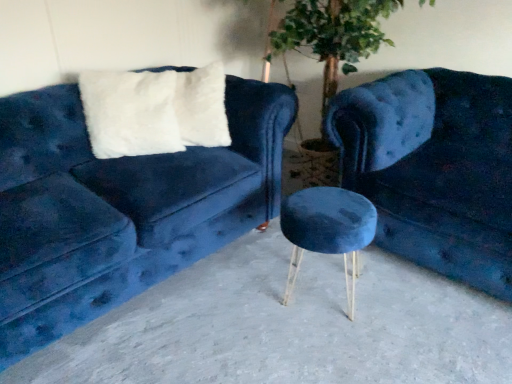
Find the location of `free space that is to the left of velvet blue stool at center`. free space that is to the left of velvet blue stool at center is located at coordinates (241, 300).